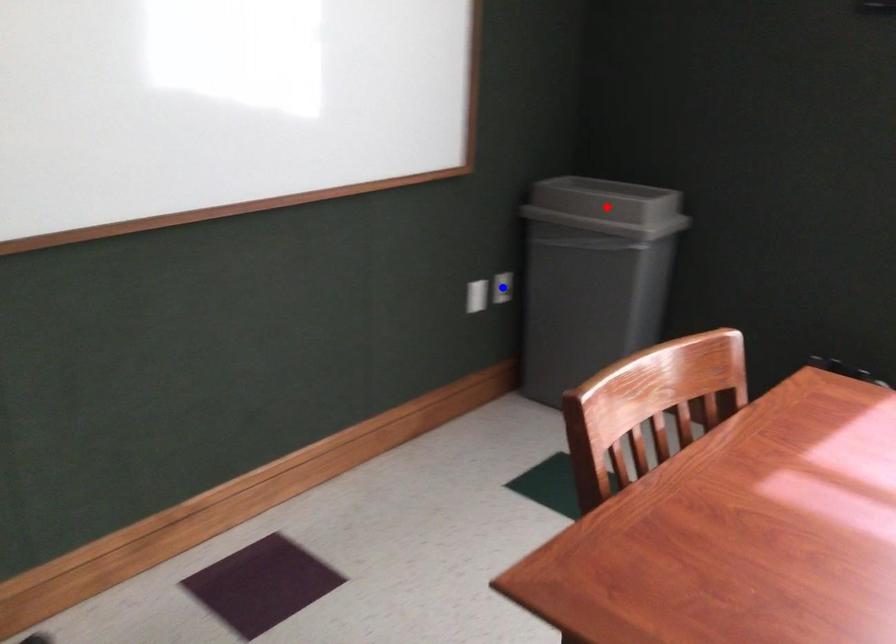
Question: In the image, two points are highlighted. Which point is nearer to the camera? Reply with the corresponding letter.

Choices:
 (A) blue point
 (B) red point

Answer: (B)